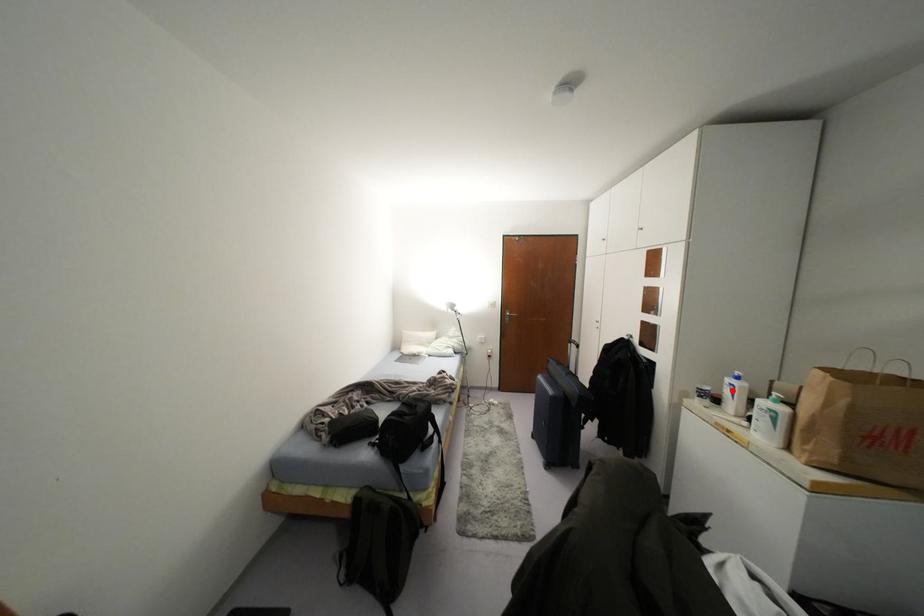
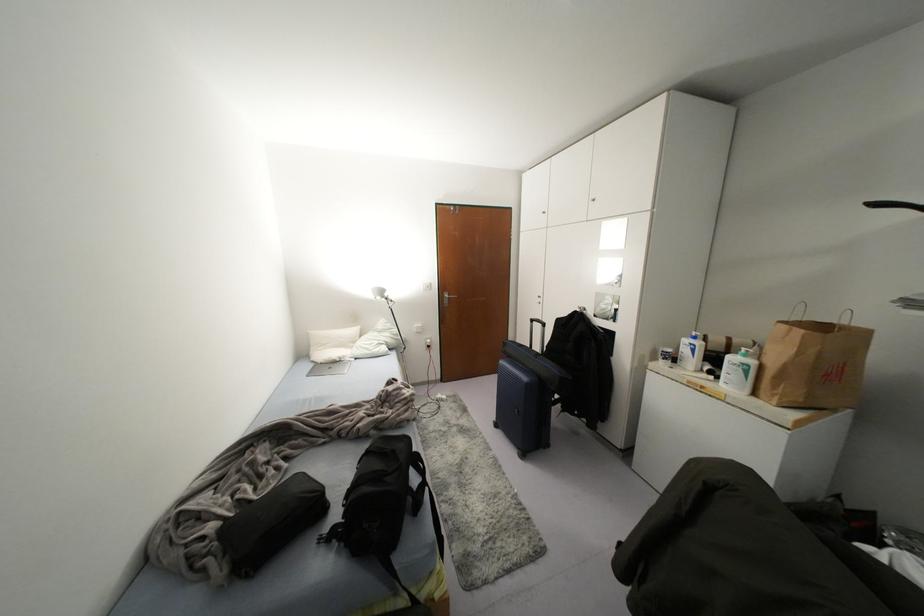
In the second image, find the point that corresponds to the highlighted location in the first image.

(691, 350)